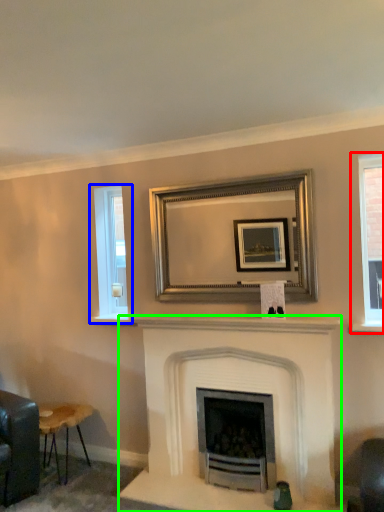
Question: Based on their relative distances, which object is farther from window (highlighted by a red box)? Choose from window (highlighted by a blue box) and fireplace (highlighted by a green box).

Choices:
 (A) window
 (B) fireplace

Answer: (A)